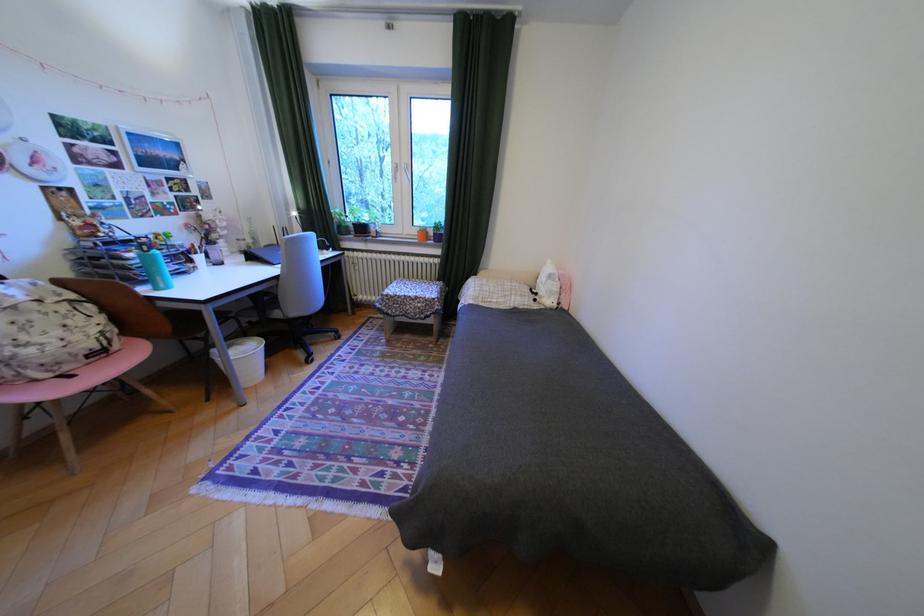
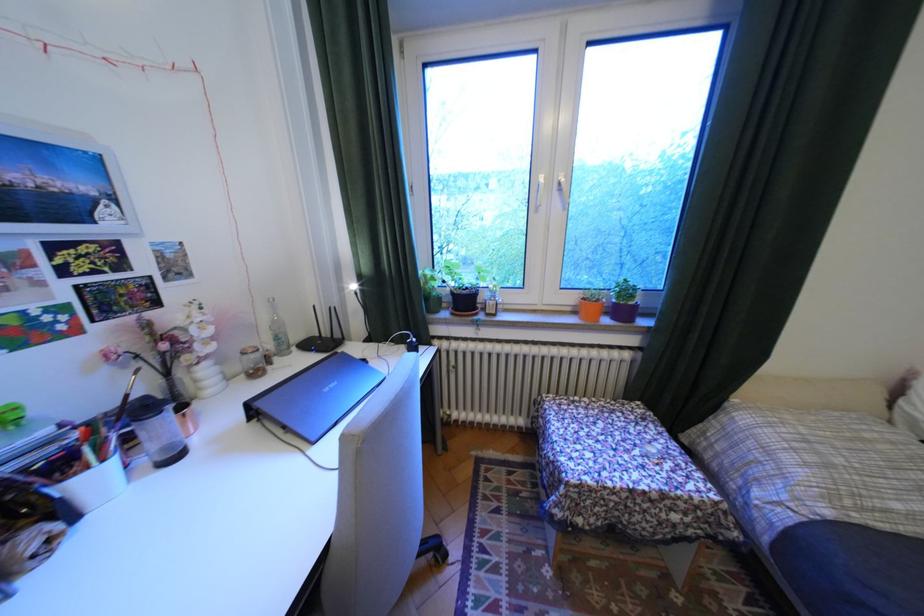
Locate, in the second image, the point that corresponds to (x=212, y=257) in the first image.

(106, 479)